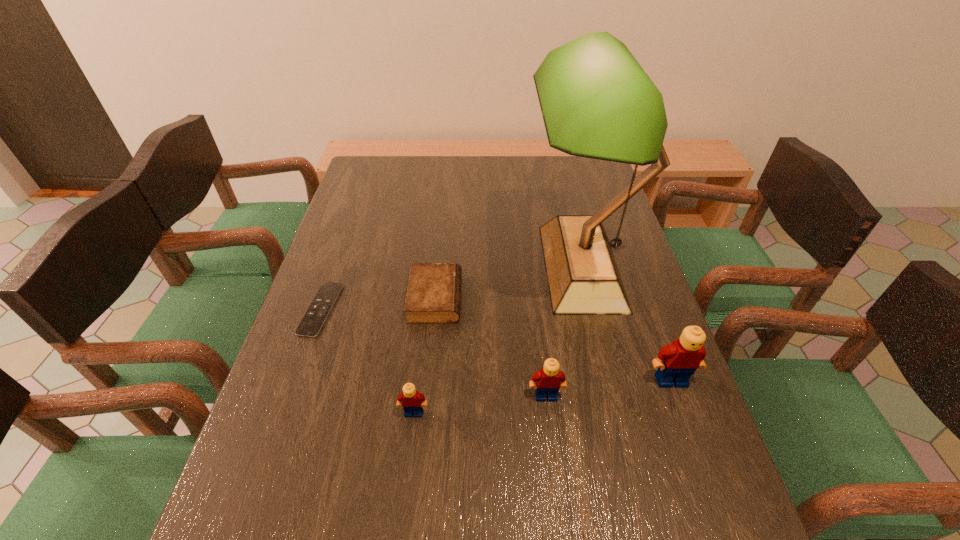
Where is `free space that satisfies the following two spatial constraints: 1. on the metallic stand of the table lamp; 2. on the front-facing side of the second nearest object`? free space that satisfies the following two spatial constraints: 1. on the metallic stand of the table lamp; 2. on the front-facing side of the second nearest object is located at coordinates click(x=612, y=396).

Locate an element on the screen. free point that satisfies the following two spatial constraints: 1. on the spine side of the fifth tallest object; 2. on the front-facing side of the nearest object is located at coordinates (424, 413).